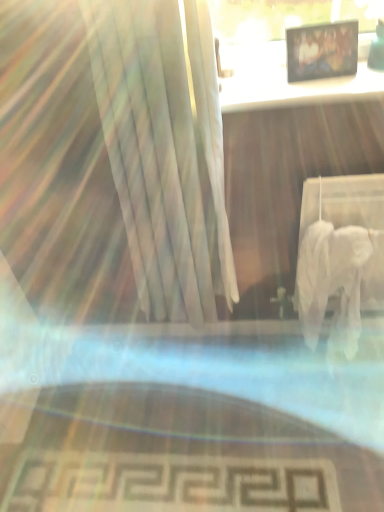
Question: Is the depth of wooden table at upper center less than that of wooden photo frame at upper center?

Choices:
 (A) no
 (B) yes

Answer: (B)

Question: Can you confirm if wooden table at upper center is taller than wooden photo frame at upper center?

Choices:
 (A) no
 (B) yes

Answer: (A)

Question: Is wooden table at upper center to the left of wooden photo frame at upper center from the viewer's perspective?

Choices:
 (A) yes
 (B) no

Answer: (A)

Question: Does wooden table at upper center have a greater width compared to wooden photo frame at upper center?

Choices:
 (A) no
 (B) yes

Answer: (B)

Question: Considering the relative positions of wooden table at upper center and wooden photo frame at upper center in the image provided, is wooden table at upper center to the right of wooden photo frame at upper center from the viewer's perspective?

Choices:
 (A) yes
 (B) no

Answer: (B)

Question: Does wooden table at upper center have a lesser width compared to wooden photo frame at upper center?

Choices:
 (A) no
 (B) yes

Answer: (A)

Question: Is wooden photo frame at upper center outside of wooden table at upper center?

Choices:
 (A) no
 (B) yes

Answer: (B)

Question: Is wooden photo frame at upper center not close to wooden table at upper center?

Choices:
 (A) no
 (B) yes

Answer: (A)

Question: Is wooden photo frame at upper center to the right of wooden table at upper center from the viewer's perspective?

Choices:
 (A) yes
 (B) no

Answer: (A)

Question: Does wooden photo frame at upper center have a lesser width compared to wooden table at upper center?

Choices:
 (A) no
 (B) yes

Answer: (B)

Question: Are wooden photo frame at upper center and wooden table at upper center beside each other?

Choices:
 (A) yes
 (B) no

Answer: (A)

Question: From the image's perspective, is wooden photo frame at upper center beneath wooden table at upper center?

Choices:
 (A) no
 (B) yes

Answer: (A)

Question: In terms of width, does wooden table at upper center look wider or thinner when compared to wooden photo frame at upper center?

Choices:
 (A) thin
 (B) wide

Answer: (B)